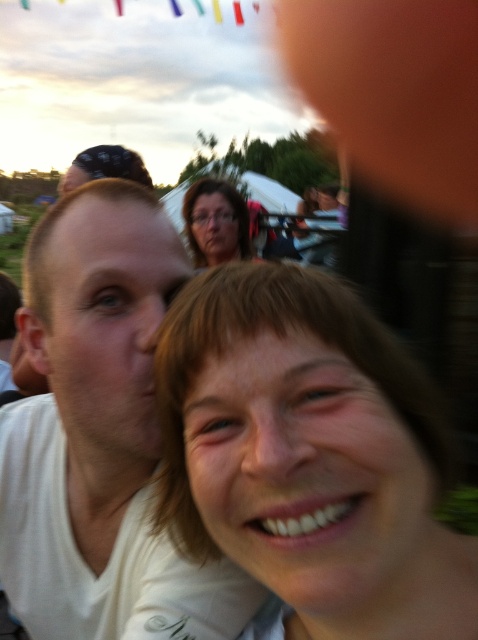
Question: Among these points, which one is farthest from the camera?

Choices:
 (A) (74, 216)
 (B) (195, 202)

Answer: (B)

Question: Does smooth beige shirt at center have a greater width compared to white matte shirt at left?

Choices:
 (A) yes
 (B) no

Answer: (B)

Question: Which point is closer to the camera?

Choices:
 (A) matte black glasses at upper center
 (B) white matte shirt at left

Answer: (B)

Question: Can you confirm if smooth beige shirt at center is bigger than matte black glasses at upper center?

Choices:
 (A) yes
 (B) no

Answer: (B)

Question: Can you confirm if white matte shirt at left is positioned to the left of matte black glasses at upper center?

Choices:
 (A) yes
 (B) no

Answer: (A)

Question: Which point appears closest to the camera in this image?

Choices:
 (A) (214, 240)
 (B) (394, 547)
 (C) (107, 232)

Answer: (B)